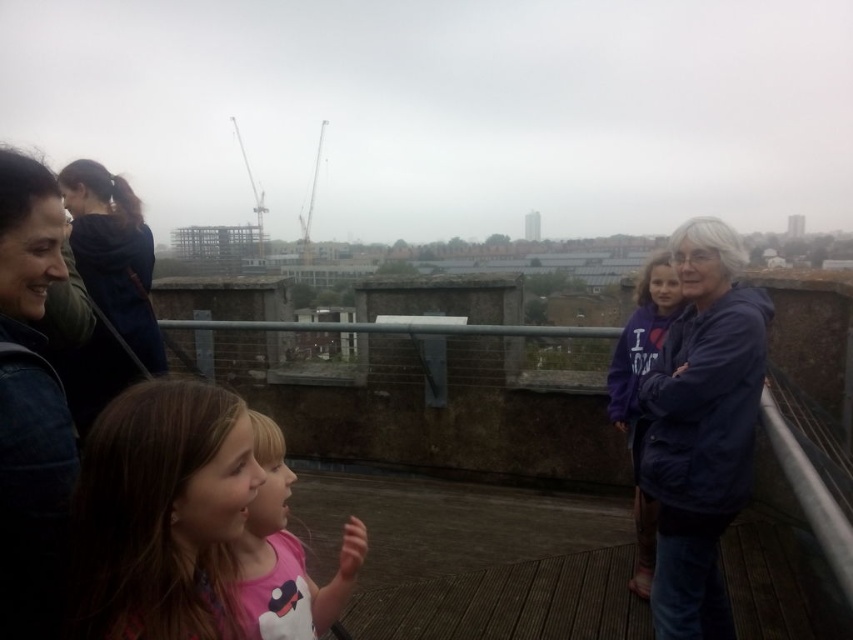
You are a photographer trying to capture a photo of the navy blue jacket at right and the dark blue denim jacket at left. Since you want both jackets to be clearly visible in the frame, which jacket should you focus on first to ensure depth of field captures both?

The navy blue jacket at right is positioned over the dark blue denim jacket at left, so focusing on the navy blue jacket at right first will ensure both are in focus as it is closer to the camera.

You are standing at point (194,554) and want to take a photo of the rooftop scene. The camera you have can focus on objects within 2 meters. Will the entire scene be in focus?

The distance between point (194,554) and the camera is 1.95 meters, which is within the camera focus range of 2 meters. Therefore, the entire scene will be in focus.